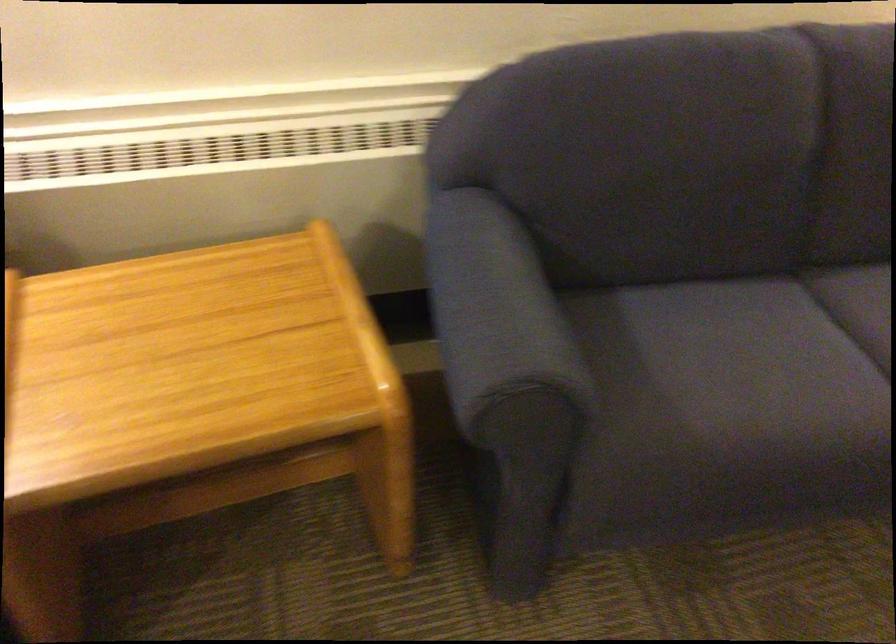
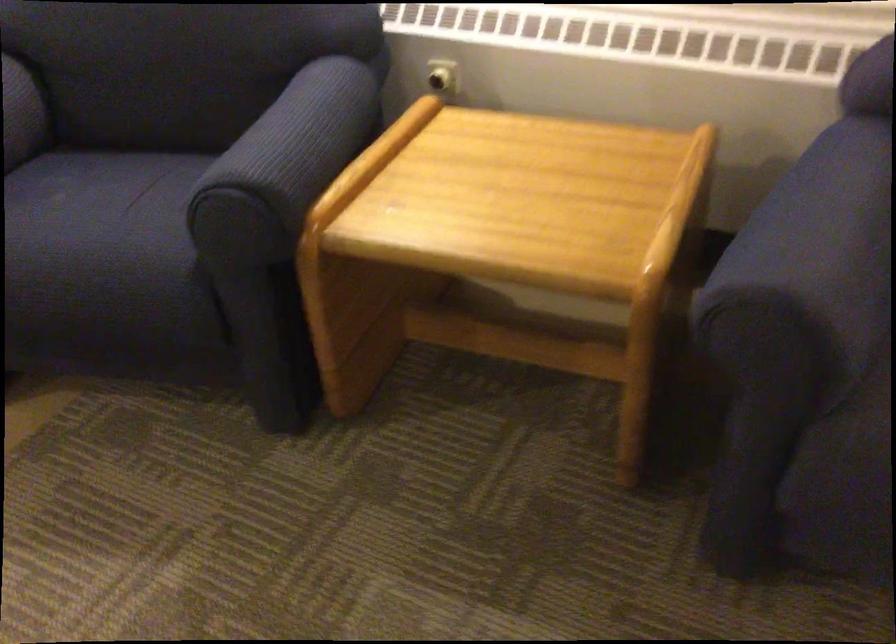
In the second image, find the point that corresponds to (530,313) in the first image.

(821, 238)